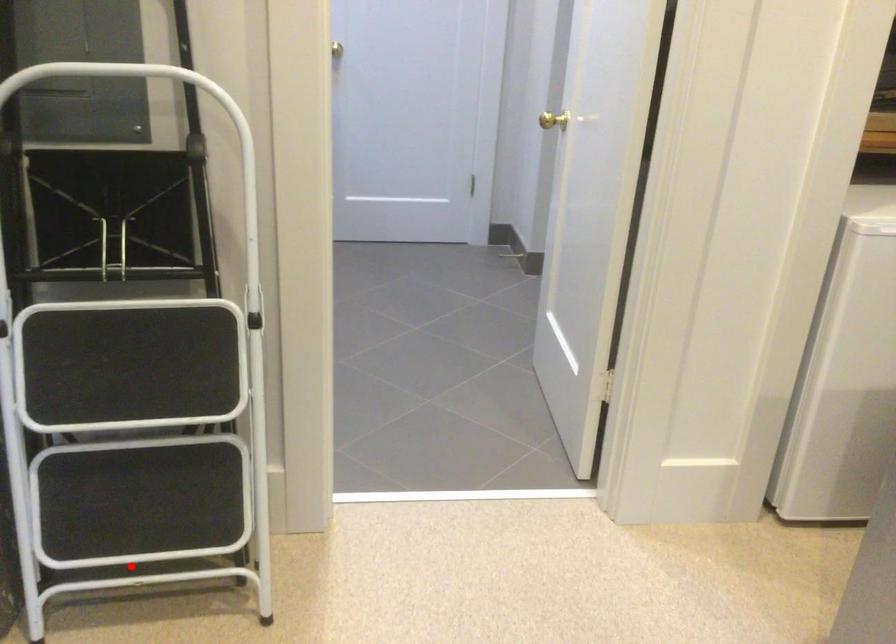
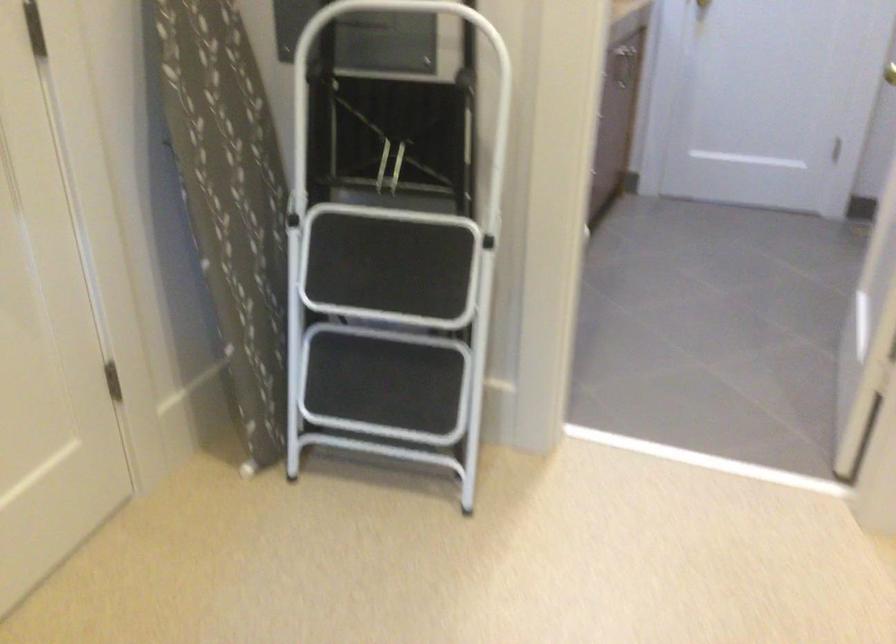
Locate, in the second image, the point that corresponds to the highlighted location in the first image.

(380, 440)